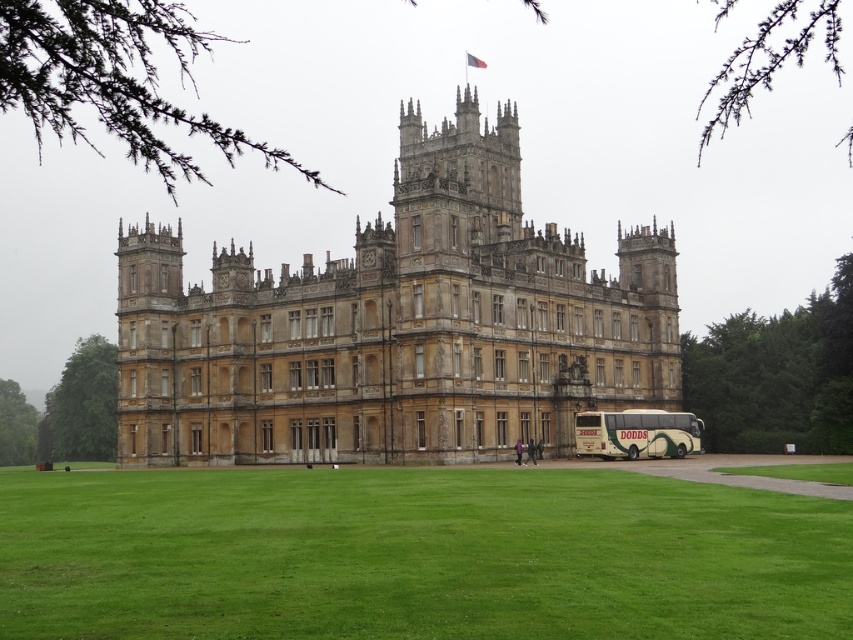
You are a photographer planning to take a photo of the golden stone castle at center and the beige textured bus at lower right. Based on their positions, which object should you focus on first if you want to capture both in a single frame without moving the camera?

The golden stone castle at center is located above the beige textured bus at lower right, so you should focus on the golden stone castle at center first to ensure both are in the frame.

You are a photographer planning to capture the golden stone castle at center and the green grass at lower center in a single frame. Based on their sizes in the image, which object would appear larger in your photograph?

The golden stone castle at center appears larger than the green grass at lower center in the image because the green grass at lower center is smaller than the golden stone castle at center.